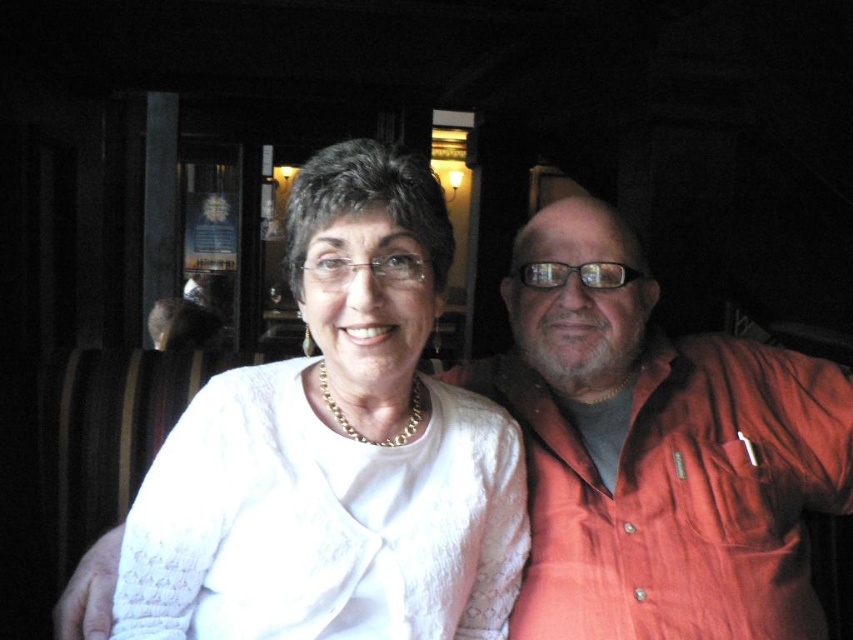
Based on the scene description, where is the white textured blouse at center located in the image?

The white textured blouse at center is located at point (335, 451).

Based on the photo, you are a photographer setting up a photo shoot. You need to place a narrow accessory between the white textured blouse at center and the matte orange shirt at center. Based on the scene description, will the accessory fit between them if it requires a space narrower than the thinner of the two?

The white textured blouse at center is thinner than the matte orange shirt at center. Since the accessory requires a space narrower than the thinner item, it would not fit between them because the thinner item itself may not provide enough space.

You are a photographer trying to adjust the focus of your camera. The subject you want to focus on is the white textured blouse at center. If the camera has a focus range of 70 centimeters, will it be able to focus on the blouse?

The white textured blouse at center and camera are 79.04 centimeters apart from each other. Since the focus range is 70 centimeters, the camera cannot focus on the blouse because it is beyond the maximum focus distance of 70 centimeters.